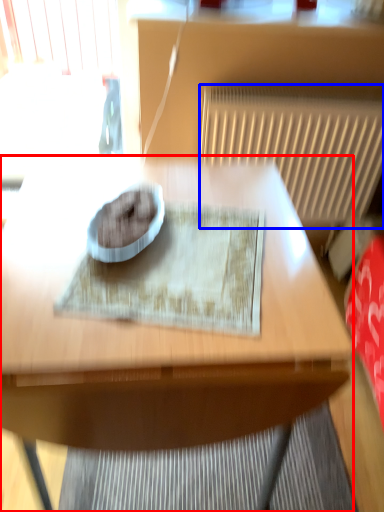
Question: Which point is further to the camera, table (highlighted by a red box) or radiator (highlighted by a blue box)?

Choices:
 (A) table
 (B) radiator

Answer: (B)